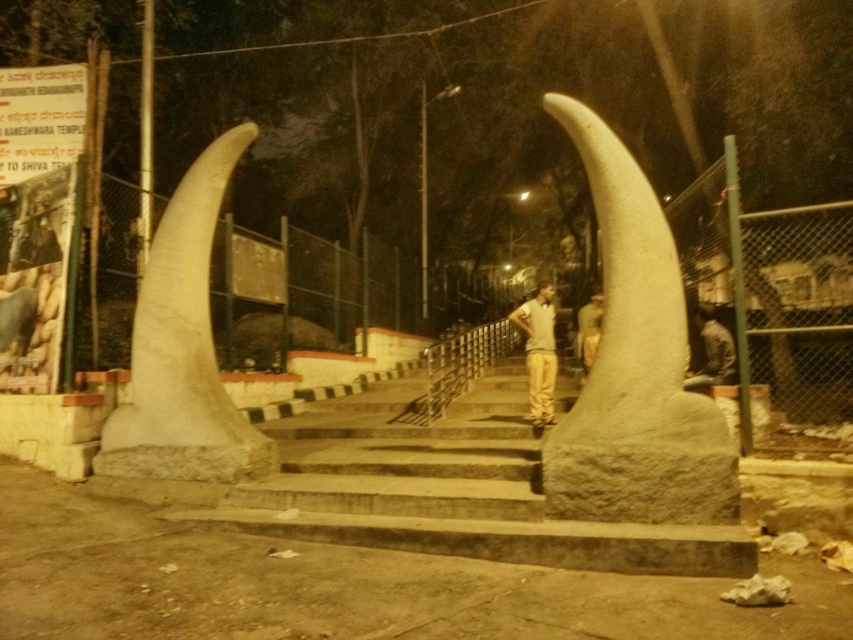
You are standing at the base of the staircase in the nighttime scene. You notice two points marked in the image. Which point, point (x=558, y=428) or point (x=593, y=317), is closer to you?

Point (x=558, y=428) is closer to the camera than point (x=593, y=317), so it is closer to you.

What is the color of the object located at the coordinates point (x=635, y=365)?

The object located at point (x=635, y=365) is the white stone tusk at center.

You are standing at the base of the staircase and see the white stone tusk at center and the green fabric uniform at center. Which object is located higher up in the scene?

The white stone tusk at center is positioned over the green fabric uniform at center, so it is higher up.